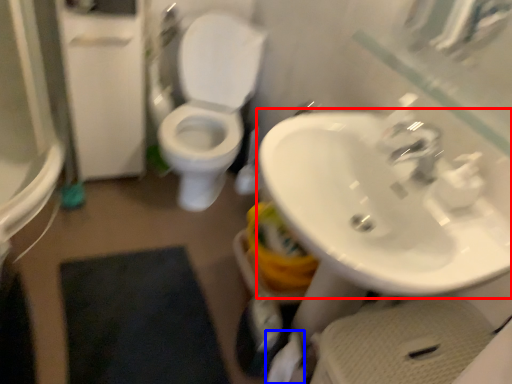
Question: Which point is further to the camera, sink (highlighted by a red box) or toilet paper (highlighted by a blue box)?

Choices:
 (A) sink
 (B) toilet paper

Answer: (B)